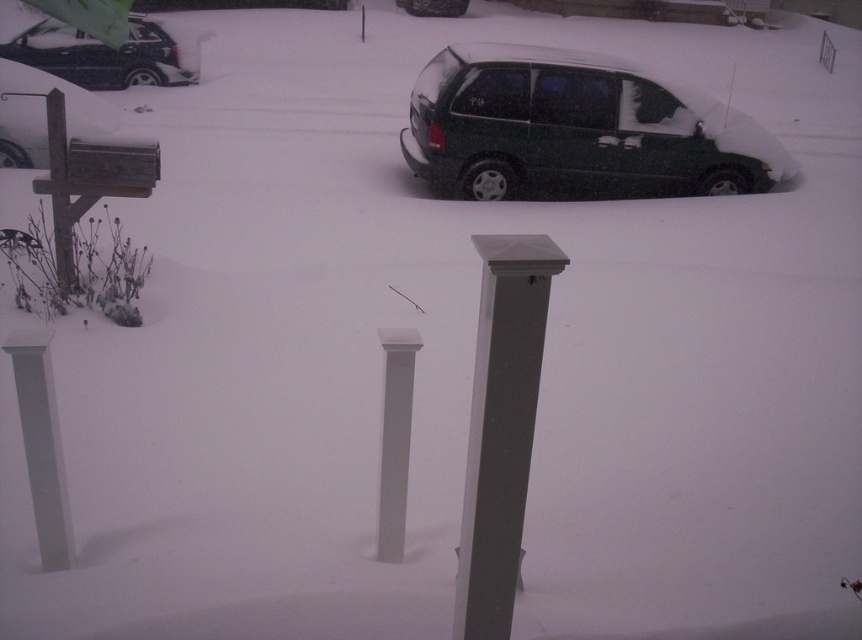
Does green matte minivan at upper right have a smaller size compared to white smooth post at left?

Actually, green matte minivan at upper right might be larger than white smooth post at left.

Is point (572, 141) positioned after point (51, 460)?

Yes, it is behind point (51, 460).

The height and width of the screenshot is (640, 862). What are the coordinates of `green matte minivan at upper right` in the screenshot? It's located at point(575,125).

Is point (491, 138) closer to viewer compared to point (166, 49)?

Yes, point (491, 138) is in front of point (166, 49).

Is green matte minivan at upper right further to the viewer compared to matte black car at upper left?

No.

Is point (653, 140) positioned after point (75, 35)?

No, (653, 140) is closer to viewer.

Where is `green matte minivan at upper right`? This screenshot has height=640, width=862. green matte minivan at upper right is located at coordinates (575, 125).

The image size is (862, 640). Identify the location of matte black car at upper left. (110, 52).

Is matte black car at upper left bigger than white smooth column at center?

Yes.

Is point (128, 83) in front of point (398, 412)?

No, it is not.

The image size is (862, 640). In order to click on matte black car at upper left in this screenshot , I will do `click(110, 52)`.